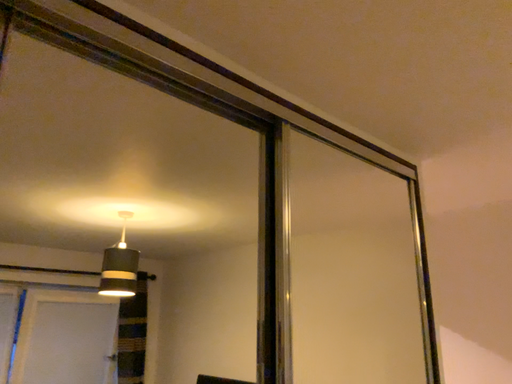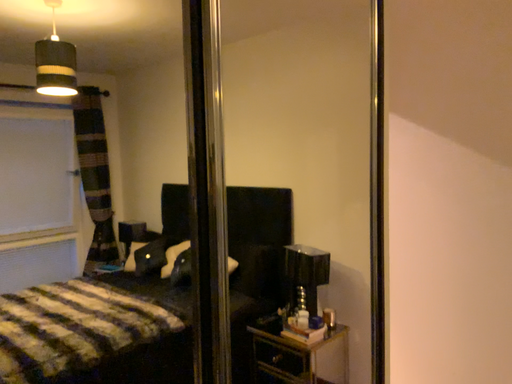
Question: How did the camera likely rotate when shooting the video?

Choices:
 (A) rotated downward
 (B) rotated upward

Answer: (A)